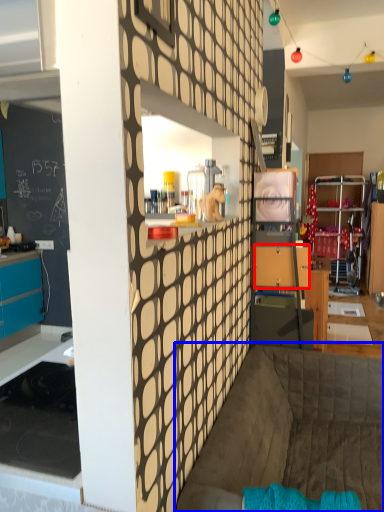
Question: Among these objects, which one is farthest to the camera, drawer (highlighted by a red box) or couch (highlighted by a blue box)?

Choices:
 (A) drawer
 (B) couch

Answer: (A)